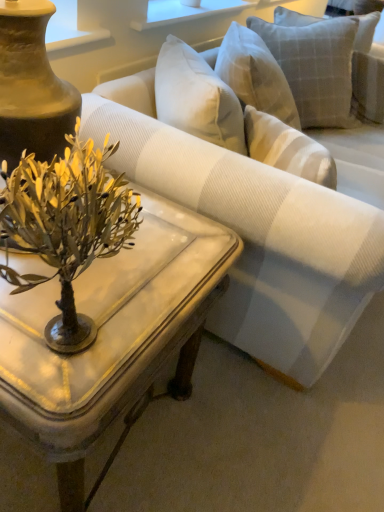
Question: Is the position of white striped fabric couch at center less distant than that of light gray textured pillow at upper right?

Choices:
 (A) no
 (B) yes

Answer: (B)

Question: Is white striped fabric couch at center positioned beyond the bounds of light gray textured pillow at upper right?

Choices:
 (A) yes
 (B) no

Answer: (A)

Question: Does white striped fabric couch at center have a greater width compared to light gray textured pillow at upper right?

Choices:
 (A) yes
 (B) no

Answer: (A)

Question: Is white striped fabric couch at center positioned with its back to light gray textured pillow at upper right?

Choices:
 (A) yes
 (B) no

Answer: (A)

Question: From a real-world perspective, is white striped fabric couch at center on top of light gray textured pillow at upper right?

Choices:
 (A) yes
 (B) no

Answer: (B)

Question: Considering the relative positions of white striped fabric couch at center and light gray textured pillow at upper right in the image provided, is white striped fabric couch at center to the right of light gray textured pillow at upper right from the viewer's perspective?

Choices:
 (A) no
 (B) yes

Answer: (A)

Question: Considering the relative sizes of white marble coffee table at center and white striped fabric couch at center in the image provided, is white marble coffee table at center thinner than white striped fabric couch at center?

Choices:
 (A) yes
 (B) no

Answer: (A)

Question: Is white marble coffee table at center directly adjacent to white striped fabric couch at center?

Choices:
 (A) no
 (B) yes

Answer: (A)

Question: Considering the relative sizes of white marble coffee table at center and white striped fabric couch at center in the image provided, is white marble coffee table at center wider than white striped fabric couch at center?

Choices:
 (A) yes
 (B) no

Answer: (B)

Question: Can you confirm if white marble coffee table at center is smaller than white striped fabric couch at center?

Choices:
 (A) no
 (B) yes

Answer: (B)

Question: From the image's perspective, is white marble coffee table at center above white striped fabric couch at center?

Choices:
 (A) yes
 (B) no

Answer: (B)

Question: Is white marble coffee table at center to the right of white striped fabric couch at center from the viewer's perspective?

Choices:
 (A) no
 (B) yes

Answer: (A)

Question: From a real-world perspective, is white striped fabric couch at center located beneath white marble coffee table at center?

Choices:
 (A) no
 (B) yes

Answer: (A)